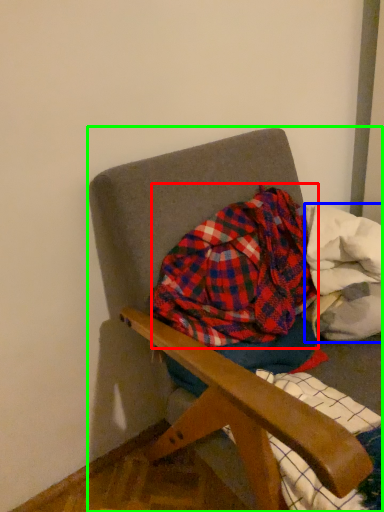
Question: Based on their relative distances, which object is farther from flannel (highlighted by a red box)? Choose from material (highlighted by a blue box) and chair (highlighted by a green box).

Choices:
 (A) material
 (B) chair

Answer: (B)